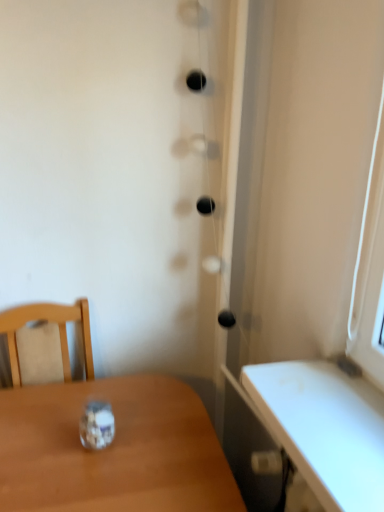
Locate an element on the screen. The height and width of the screenshot is (512, 384). vacant position to the left of clear glass jar at center is located at coordinates (39, 445).